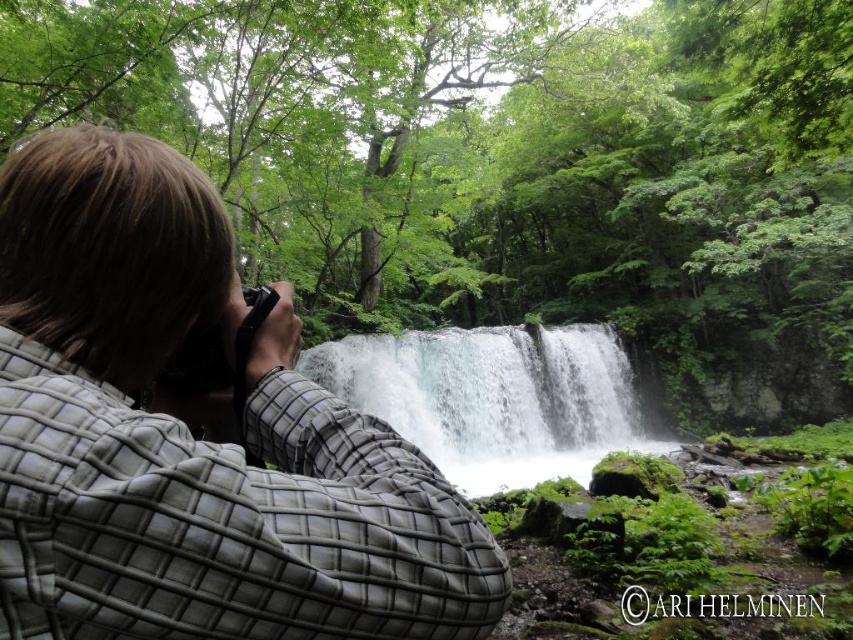
You are a photographer trying to capture the green leafy forest at center and the white frothy water at center in your shot. Which object should you focus on first if you want to ensure both are in sharp focus?

The green leafy forest at center has a larger size compared to white frothy water at center, so focusing on the larger object first would help ensure both are in sharp focus.